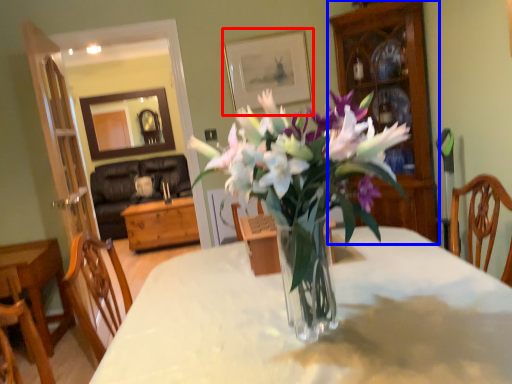
Question: Which object is closer to the camera taking this photo, picture frame (highlighted by a red box) or cabinetry (highlighted by a blue box)?

Choices:
 (A) picture frame
 (B) cabinetry

Answer: (B)